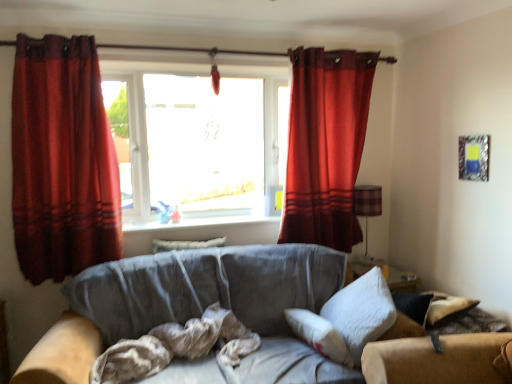
Question: Can you confirm if metallic silver picture frame at upper right is positioned to the left of velvet-like beige pillow at center, the first pillow viewed from the left?

Choices:
 (A) yes
 (B) no

Answer: (B)

Question: Would you say velvet-like beige pillow at center, the 2th pillow in the right-to-left sequence, is part of metallic silver picture frame at upper right's contents?

Choices:
 (A) yes
 (B) no

Answer: (B)

Question: Considering the relative sizes of metallic silver picture frame at upper right and velvet-like beige pillow at center, the 2th pillow in the front-to-back sequence, in the image provided, is metallic silver picture frame at upper right taller than velvet-like beige pillow at center, the 2th pillow in the front-to-back sequence,?

Choices:
 (A) no
 (B) yes

Answer: (B)

Question: Is metallic silver picture frame at upper right positioned before velvet-like beige pillow at center, the first pillow when ordered from back to front?

Choices:
 (A) yes
 (B) no

Answer: (A)

Question: Does metallic silver picture frame at upper right have a larger size compared to velvet-like beige pillow at center, the first pillow when ordered from back to front?

Choices:
 (A) yes
 (B) no

Answer: (B)

Question: Is velvet red curtain at upper right, acting as the 2th curtain starting from the front, taller or shorter than brown textured fabric at center?

Choices:
 (A) short
 (B) tall

Answer: (B)

Question: From a real-world perspective, is velvet red curtain at upper right, the first curtain positioned from the right, above or below brown textured fabric at center?

Choices:
 (A) below
 (B) above

Answer: (B)

Question: Is point (338, 66) closer or farther from the camera than point (131, 342)?

Choices:
 (A) closer
 (B) farther

Answer: (B)

Question: Is velvet red curtain at upper right, acting as the 2th curtain starting from the front, bigger or smaller than brown textured fabric at center?

Choices:
 (A) big
 (B) small

Answer: (A)

Question: In the image, is suede gray couch at center positioned in front of or behind brown textured fabric at center?

Choices:
 (A) front
 (B) behind

Answer: (A)

Question: Looking at the image, does suede gray couch at center seem bigger or smaller compared to brown textured fabric at center?

Choices:
 (A) big
 (B) small

Answer: (A)

Question: Do you think suede gray couch at center is within brown textured fabric at center, or outside of it?

Choices:
 (A) outside
 (B) inside

Answer: (A)

Question: From a real-world perspective, relative to brown textured fabric at center, is suede gray couch at center vertically above or below?

Choices:
 (A) below
 (B) above

Answer: (A)

Question: From a real-world perspective, is velvet red curtain at upper right, the first curtain positioned from the right, positioned above or below metallic silver picture frame at upper right?

Choices:
 (A) above
 (B) below

Answer: (A)

Question: Considering the positions of velvet red curtain at upper right, acting as the 2th curtain starting from the front, and metallic silver picture frame at upper right in the image, is velvet red curtain at upper right, acting as the 2th curtain starting from the front, taller or shorter than metallic silver picture frame at upper right?

Choices:
 (A) tall
 (B) short

Answer: (A)